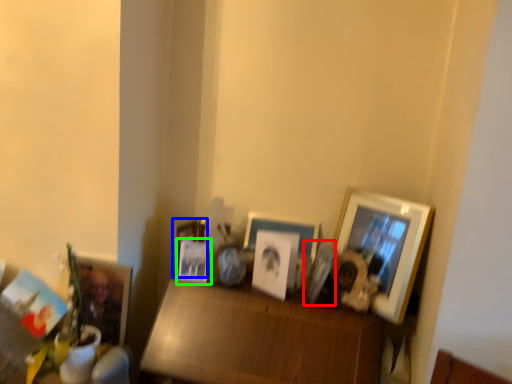
Question: Which object is positioned farthest from picture frame (highlighted by a red box)? Select from picture frame (highlighted by a blue box) and picture frame (highlighted by a green box).

Choices:
 (A) picture frame
 (B) picture frame

Answer: (A)